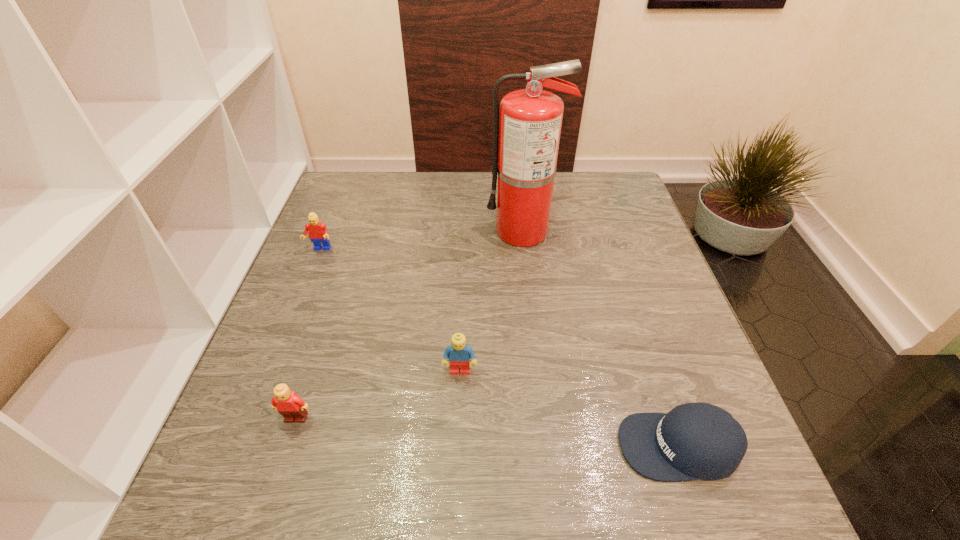
This screenshot has height=540, width=960. In order to click on free space located 0.180m at the nozzle of the fire extinguisher in this screenshot , I will do `click(420, 231)`.

Where is `vacant area situated 0.340m at the nozzle of the fire extinguisher`? This screenshot has width=960, height=540. vacant area situated 0.340m at the nozzle of the fire extinguisher is located at coordinates [361, 231].

The width and height of the screenshot is (960, 540). Find the location of `vacant space situated at the nozzle of the fire extinguisher`. vacant space situated at the nozzle of the fire extinguisher is located at coordinates (405, 231).

The image size is (960, 540). Find the location of `free spot located on the front-facing side of the farthest Lego`. free spot located on the front-facing side of the farthest Lego is located at coordinates (283, 341).

Locate an element on the screen. Image resolution: width=960 pixels, height=540 pixels. vacant position located 0.110m on the face of the rightmost Lego is located at coordinates (458, 431).

Locate an element on the screen. vacant region located 0.150m on the face of the fourth object from right to left is located at coordinates (265, 514).

Identify the location of vacant space located 0.160m on the front-facing side of the baseball cap. Image resolution: width=960 pixels, height=540 pixels. point(527,446).

The height and width of the screenshot is (540, 960). I want to click on vacant space located 0.390m on the front-facing side of the baseball cap, so click(x=395, y=446).

At what (x,y) coordinates should I click in order to perform the action: click on vacant space located 0.180m on the front-facing side of the baseball cap. Please return your answer as a coordinate pair (x, y). This screenshot has width=960, height=540. Looking at the image, I should click on (516, 446).

At what (x,y) coordinates should I click in order to perform the action: click on object that is at the far edge. Please return your answer as a coordinate pair (x, y). The height and width of the screenshot is (540, 960). Looking at the image, I should click on (528, 135).